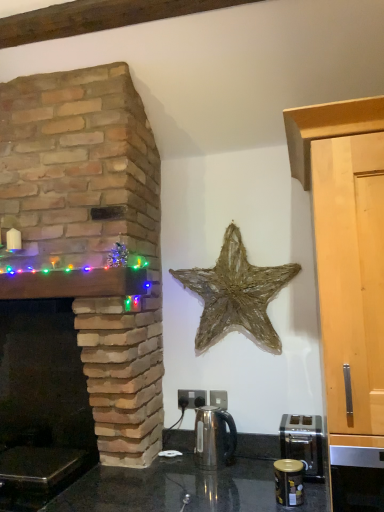
This screenshot has width=384, height=512. What do you see at coordinates (180, 482) in the screenshot? I see `black granite countertop at lower center` at bounding box center [180, 482].

Measure the distance between satin silver toaster at lower right, the first appliance from the back, and camera.

satin silver toaster at lower right, the first appliance from the back, is 1.49 meters from camera.

Find the location of a particular element. Image resolution: width=384 pixels, height=512 pixels. black granite countertop at lower center is located at coordinates (180, 482).

Would you say natural stone fireplace at left is a long distance from woven straw star at center?

They are positioned close to each other.

From the image's perspective, who appears lower, natural stone fireplace at left or woven straw star at center?

woven straw star at center.

From a real-world perspective, between natural stone fireplace at left and woven straw star at center, who is vertically lower?

From a 3D spatial view, woven straw star at center is below.

Could you tell me if natural stone fireplace at left is facing woven straw star at center?

No, natural stone fireplace at left is not oriented towards woven straw star at center.

From the image's perspective, which one is positioned higher, black granite countertop at lower center or satin silver toaster at lower right, the first appliance from the back?

satin silver toaster at lower right, the first appliance from the back, from the image's perspective.

Visually, is black granite countertop at lower center positioned to the left or to the right of satin silver toaster at lower right, the first appliance from the back?

black granite countertop at lower center is to the left of satin silver toaster at lower right, the first appliance from the back.

Considering the relative sizes of black granite countertop at lower center and satin silver toaster at lower right, the 2th appliance in the front-to-back sequence, in the image provided, is black granite countertop at lower center taller than satin silver toaster at lower right, the 2th appliance in the front-to-back sequence,?

Yes.

From the picture: Is black granite countertop at lower center inside or outside of satin silver toaster at lower right, the first appliance from the back?

black granite countertop at lower center is spatially situated outside satin silver toaster at lower right, the first appliance from the back.

Which is behind, point (196, 437) or point (297, 458)?

Point (196, 437)

Is satin silver kettle at center not near satin silver toaster at lower right, the 2th appliance in the front-to-back sequence?

satin silver kettle at center is near satin silver toaster at lower right, the 2th appliance in the front-to-back sequence, not far away.

Which appliance is the 1st one when counting from the front of the satin silver kettle at center? Please provide its 2D coordinates.

[(302, 442)]

Is woven straw star at center with black granite countertop at lower center?

No, woven straw star at center is not in contact with black granite countertop at lower center.

From a real-world perspective, relative to black granite countertop at lower center, is woven straw star at center vertically above or below?

woven straw star at center is situated higher than black granite countertop at lower center in the real world.

Considering the relative positions of woven straw star at center and black granite countertop at lower center in the image provided, is woven straw star at center behind black granite countertop at lower center?

Yes, woven straw star at center is further from the camera.

How different are the orientations of woven straw star at center and black granite countertop at lower center in degrees?

They differ by 0.00266 degrees in their facing directions.

Could you tell me if light wood cabinet at right is facing satin silver kettle at center?

No, light wood cabinet at right is not aimed at satin silver kettle at center.

From a real-world perspective, is light wood cabinet at right located higher than satin silver kettle at center?

Correct, in the physical world, light wood cabinet at right is higher than satin silver kettle at center.

Considering the relative sizes of light wood cabinet at right and satin silver kettle at center in the image provided, is light wood cabinet at right thinner than satin silver kettle at center?

Incorrect, the width of light wood cabinet at right is not less than that of satin silver kettle at center.

Is point (292, 114) positioned in front of point (218, 430)?

Yes, point (292, 114) is in front of point (218, 430).

Does metallic gold canister at lower right, arranged as the 1th appliance when viewed from the front, touch light wood cabinet at right?

metallic gold canister at lower right, arranged as the 1th appliance when viewed from the front, and light wood cabinet at right are clearly separated.

Who is shorter, metallic gold canister at lower right, the second appliance from the back, or light wood cabinet at right?

metallic gold canister at lower right, the second appliance from the back.

Can you confirm if metallic gold canister at lower right, the second appliance from the back, is smaller than light wood cabinet at right?

Indeed, metallic gold canister at lower right, the second appliance from the back, has a smaller size compared to light wood cabinet at right.

Which point is more distant from viewer, (242, 280) or (307, 473)?

The point (242, 280) is farther from the camera.

This screenshot has height=512, width=384. In order to click on starfish that appears above the satin silver toaster at lower right, the first appliance from the back (from the image's perspective) in this screenshot , I will do `click(236, 294)`.

Is woven straw star at center facing towards satin silver toaster at lower right, the first appliance from the back?

No.

Between woven straw star at center and satin silver toaster at lower right, the 2th appliance in the front-to-back sequence, which one is positioned in front?

satin silver toaster at lower right, the 2th appliance in the front-to-back sequence.

Image resolution: width=384 pixels, height=512 pixels. Find the location of `fireplace above the woven straw star at center (from the image's perspective)`. fireplace above the woven straw star at center (from the image's perspective) is located at coordinates (91, 237).

What are the coordinates of `counter top below the satin silver toaster at lower right, the first appliance from the back (from the image's perspective)` in the screenshot? It's located at (180, 482).

Based on their spatial positions, is satin silver kettle at center or black granite countertop at lower center further from woven straw star at center?

Based on the image, black granite countertop at lower center appears to be further to woven straw star at center.

Looking at the image, which one is located further to black granite countertop at lower center, satin silver kettle at center or natural stone fireplace at left?

Among the two, natural stone fireplace at left is located further to black granite countertop at lower center.

Looking at this image, looking at the image, which one is located further to satin silver toaster at lower right, the first appliance from the back, metallic gold canister at lower right, the second appliance from the back, or natural stone fireplace at left?

natural stone fireplace at left lies further to satin silver toaster at lower right, the first appliance from the back, than the other object.

Which object lies further to the anchor point satin silver toaster at lower right, the first appliance from the back, metallic gold canister at lower right, arranged as the 1th appliance when viewed from the front, or light wood cabinet at right?

light wood cabinet at right is positioned further to the anchor satin silver toaster at lower right, the first appliance from the back.

Considering their positions, is satin silver kettle at center positioned closer to metallic gold canister at lower right, arranged as the 1th appliance when viewed from the front, than black granite countertop at lower center?

satin silver kettle at center is closer to metallic gold canister at lower right, arranged as the 1th appliance when viewed from the front.

From the image, which object appears to be farther from natural stone fireplace at left, satin silver kettle at center or metallic gold canister at lower right, the second appliance from the back?

metallic gold canister at lower right, the second appliance from the back.

Which object lies further to the anchor point light wood cabinet at right, metallic gold canister at lower right, the second appliance from the back, or natural stone fireplace at left?

natural stone fireplace at left is positioned further to the anchor light wood cabinet at right.

Which object lies nearer to the anchor point woven straw star at center, metallic gold canister at lower right, arranged as the 1th appliance when viewed from the front, or light wood cabinet at right?

metallic gold canister at lower right, arranged as the 1th appliance when viewed from the front, is positioned closer to the anchor woven straw star at center.

Identify the location of tea pot between natural stone fireplace at left and black granite countertop at lower center in the vertical direction. (214, 438).

Identify the location of appliance that lies between woven straw star at center and satin silver toaster at lower right, the first appliance from the back, from top to bottom. (289, 482).

This screenshot has height=512, width=384. Find the location of `tea pot located between light wood cabinet at right and woven straw star at center in the depth direction`. tea pot located between light wood cabinet at right and woven straw star at center in the depth direction is located at coordinates (214, 438).

Find the location of a particular element. Image resolution: width=384 pixels, height=512 pixels. tea pot between natural stone fireplace at left and woven straw star at center is located at coordinates (214, 438).